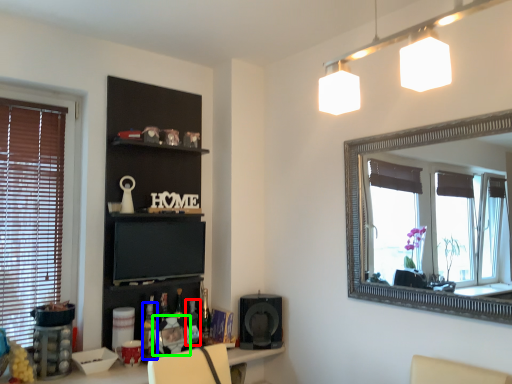
Question: Which object is the farthest from bottle (highlighted by a red box)? Choose among these: bottle (highlighted by a blue box) or picture frame (highlighted by a green box).

Choices:
 (A) bottle
 (B) picture frame

Answer: (A)